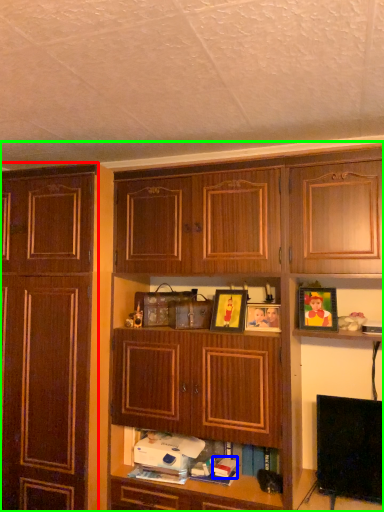
Question: Considering the real-world distances, which object is farthest from cabinetry (highlighted by a red box)? book (highlighted by a blue box) or cabinetry (highlighted by a green box)?

Choices:
 (A) book
 (B) cabinetry

Answer: (A)